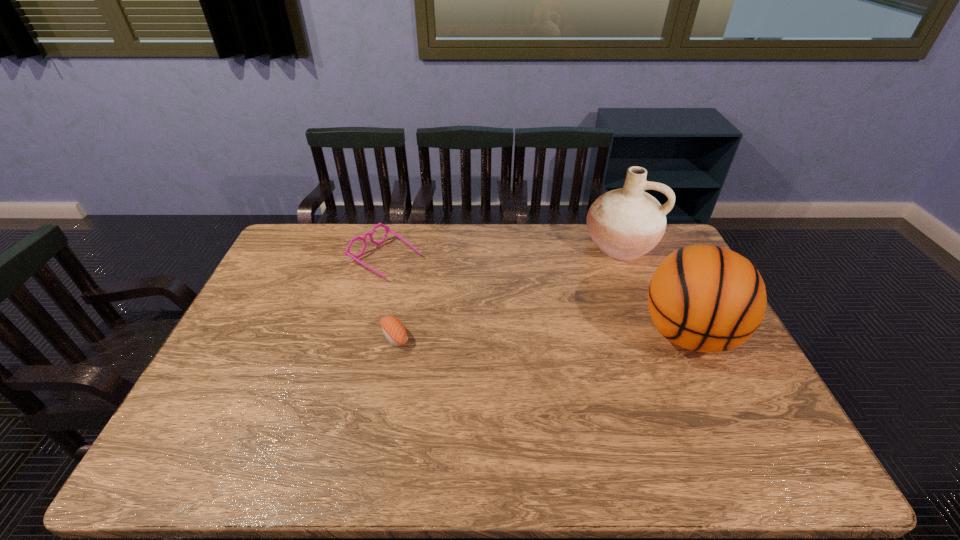
Select which object appears as the second closest to the pottery. Please provide its 2D coordinates. Your answer should be formatted as a tuple, i.e. [(x, y)], where the tuple contains the x and y coordinates of a point satisfying the conditions above.

[(347, 252)]

Where is `object that stands as the second closest to the basketball`? The height and width of the screenshot is (540, 960). object that stands as the second closest to the basketball is located at coordinates (393, 329).

What are the coordinates of `free space that satisfies the following two spatial constraints: 1. on the back side of the spectacles; 2. on the left side of the pottery` in the screenshot? It's located at (389, 245).

Locate an element on the screen. vacant area that satisfies the following two spatial constraints: 1. on the front side of the spectacles; 2. on the left side of the basketball is located at coordinates (366, 334).

Find the location of a particular element. vacant space that satisfies the following two spatial constraints: 1. on the back side of the pottery; 2. on the left side of the third tallest object is located at coordinates (389, 245).

Locate an element on the screen. vacant position in the image that satisfies the following two spatial constraints: 1. on the front side of the basketball; 2. on the right side of the pottery is located at coordinates (656, 334).